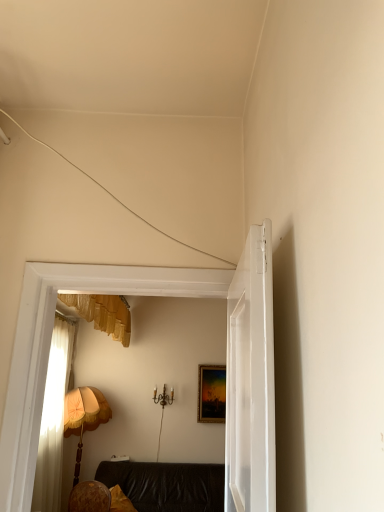
Where is `wooden fabric lampshade at left`? The height and width of the screenshot is (512, 384). wooden fabric lampshade at left is located at coordinates pos(84,416).

Identify the location of white glossy door at center. (251, 379).

Is yellow fabric pillow at lower left far away from leather couch at center?

They are positioned close to each other.

In the scene shown: Can you confirm if yellow fabric pillow at lower left is wider than leather couch at center?

No, yellow fabric pillow at lower left is not wider than leather couch at center.

Is yellow fabric pillow at lower left to the left or to the right of leather couch at center in the image?

Clearly, yellow fabric pillow at lower left is on the left of leather couch at center in the image.

Choose the correct answer: Is yellow fabric pillow at lower left inside leather couch at center or outside it?

The correct answer is: inside.

From the image's perspective, is yellow fabric pillow at lower left above white glossy door at center?

No, from the image's perspective, yellow fabric pillow at lower left is not over white glossy door at center.

Where is `door above the yellow fabric pillow at lower left (from the image's perspective)`? The width and height of the screenshot is (384, 512). door above the yellow fabric pillow at lower left (from the image's perspective) is located at coordinates (251, 379).

Can you confirm if yellow fabric pillow at lower left is thinner than white glossy door at center?

No, yellow fabric pillow at lower left is not thinner than white glossy door at center.

Is yellow fabric pillow at lower left to the right of white glossy door at center from the viewer's perspective?

No, yellow fabric pillow at lower left is not to the right of white glossy door at center.

Looking at this image, between gold-framed painting at center and yellow fabric pillow at lower left, which one has smaller width?

gold-framed painting at center is thinner.

Locate an element on the screen. Image resolution: width=384 pixels, height=512 pixels. picture frame above the yellow fabric pillow at lower left (from the image's perspective) is located at coordinates click(211, 393).

Is there a large distance between gold-framed painting at center and yellow fabric pillow at lower left?

That's right, there is a large distance between gold-framed painting at center and yellow fabric pillow at lower left.

Between gold-framed painting at center and white glossy door at center, which one appears on the right side from the viewer's perspective?

gold-framed painting at center is more to the right.

Between gold-framed painting at center and white glossy door at center, which one is positioned in front?

white glossy door at center is closer to the camera.

Image resolution: width=384 pixels, height=512 pixels. I want to click on picture frame that appears behind the white glossy door at center, so click(211, 393).

Is gold-framed painting at center thinner than white glossy door at center?

Yes, gold-framed painting at center is thinner than white glossy door at center.

Between leather couch at center and yellow fabric pillow at lower left, which one appears on the left side from the viewer's perspective?

yellow fabric pillow at lower left.

The height and width of the screenshot is (512, 384). I want to click on pillow below the leather couch at center (from a real-world perspective), so click(x=120, y=501).

How different are the orientations of wooden fabric lampshade at left and leather couch at center in degrees?

7.73e-05 degrees separate the facing orientations of wooden fabric lampshade at left and leather couch at center.

Based on the photo, can you confirm if wooden fabric lampshade at left is bigger than leather couch at center?

No.

From a real-world perspective, is wooden fabric lampshade at left positioned above or below leather couch at center?

From a real-world perspective, wooden fabric lampshade at left is physically above leather couch at center.

Does wooden fabric lampshade at left have a lesser width compared to leather couch at center?

Yes, wooden fabric lampshade at left is thinner than leather couch at center.

Which of these two, white glossy door at center or yellow fabric pillow at lower left, stands shorter?

yellow fabric pillow at lower left.

The height and width of the screenshot is (512, 384). I want to click on door that is on the right side of yellow fabric pillow at lower left, so click(x=251, y=379).

Is yellow fabric pillow at lower left inside white glossy door at center?

That's incorrect, yellow fabric pillow at lower left is not inside white glossy door at center.

Does point (227, 319) come behind point (115, 496)?

No, (227, 319) is closer to viewer.

Where is `furniture on the right side of yellow fabric pillow at lower left`? This screenshot has width=384, height=512. furniture on the right side of yellow fabric pillow at lower left is located at coordinates (167, 485).

The height and width of the screenshot is (512, 384). I want to click on door above the yellow fabric pillow at lower left (from the image's perspective), so click(x=251, y=379).

Based on their spatial positions, is gold-framed painting at center or wooden fabric lampshade at left closer to leather couch at center?

Among the two, wooden fabric lampshade at left is located nearer to leather couch at center.

From the picture: From the image, which object appears to be nearer to yellow fabric pillow at lower left, white glossy door at center or leather couch at center?

Among the two, leather couch at center is located nearer to yellow fabric pillow at lower left.

Based on their spatial positions, is yellow fabric pillow at lower left or wooden fabric lampshade at left further from white glossy door at center?

wooden fabric lampshade at left is positioned further to the anchor white glossy door at center.

Looking at this image, from the image, which object appears to be farther from yellow fabric pillow at lower left, white glossy door at center or gold-framed painting at center?

Based on the image, white glossy door at center appears to be further to yellow fabric pillow at lower left.

Estimate the real-world distances between objects in this image. Which object is closer to leather couch at center, wooden fabric lampshade at left or white glossy door at center?

wooden fabric lampshade at left.

From the picture: Which object lies further to the anchor point yellow fabric pillow at lower left, gold-framed painting at center or white glossy door at center?

Based on the image, white glossy door at center appears to be further to yellow fabric pillow at lower left.

Estimate the real-world distances between objects in this image. Which object is closer to wooden fabric lampshade at left, leather couch at center or gold-framed painting at center?

leather couch at center is positioned closer to the anchor wooden fabric lampshade at left.

Which object lies further to the anchor point gold-framed painting at center, wooden fabric lampshade at left or leather couch at center?

wooden fabric lampshade at left.

This screenshot has height=512, width=384. What are the coordinates of `furniture positioned between white glossy door at center and wooden fabric lampshade at left from near to far` in the screenshot? It's located at (167, 485).

Where is `pillow between wooden fabric lampshade at left and leather couch at center`? pillow between wooden fabric lampshade at left and leather couch at center is located at coordinates (120, 501).

Locate an element on the screen. Image resolution: width=384 pixels, height=512 pixels. pillow between leather couch at center and gold-framed painting at center along the z-axis is located at coordinates (120, 501).

At what (x,y) coordinates should I click in order to perform the action: click on pillow between wooden fabric lampshade at left and gold-framed painting at center in the horizontal direction. Please return your answer as a coordinate pair (x, y). This screenshot has width=384, height=512. Looking at the image, I should click on (120, 501).